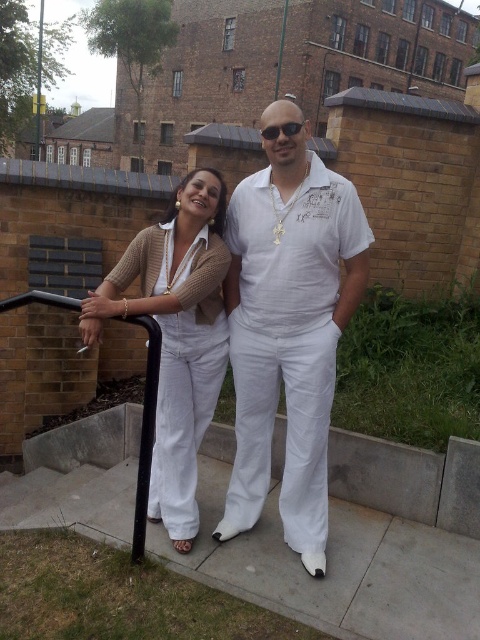
Is white matte shirt at center taller than black metal/rail at left?

Indeed, white matte shirt at center has a greater height compared to black metal/rail at left.

Is white matte shirt at center below black metal/rail at left?

No.

Is point (276, 177) positioned before point (144, 477)?

No, (276, 177) is further to viewer.

The width and height of the screenshot is (480, 640). Find the location of `white matte shirt at center`. white matte shirt at center is located at coordinates (288, 332).

Who is positioned more to the left, matte white jumpsuit at center or black plastic sunglasses at center?

From the viewer's perspective, matte white jumpsuit at center appears more on the left side.

Is point (157, 516) less distant than point (294, 124)?

That is False.

Does point (204, 422) lie behind point (287, 134)?

Yes, point (204, 422) is farther from viewer.

At what (x,y) coordinates should I click in order to perform the action: click on matte white jumpsuit at center. Please return your answer as a coordinate pair (x, y). The image size is (480, 640). Looking at the image, I should click on (177, 337).

Between black metal/rail at left and black plastic sunglasses at center, which one has more height?

With more height is black metal/rail at left.

Is black metal/rail at left smaller than black plastic sunglasses at center?

Incorrect, black metal/rail at left is not smaller in size than black plastic sunglasses at center.

Between point (144, 486) and point (290, 125), which one is positioned behind?

The point (144, 486) is behind.

Find the location of a particular element. This screenshot has height=640, width=480. black metal/rail at left is located at coordinates (144, 428).